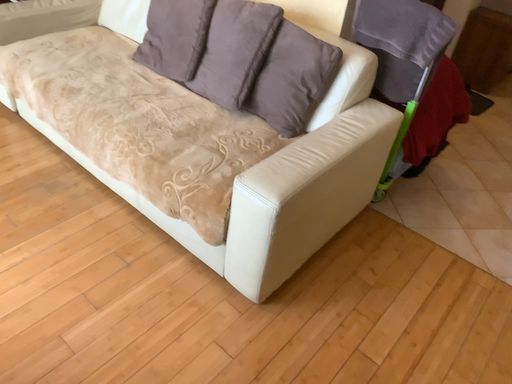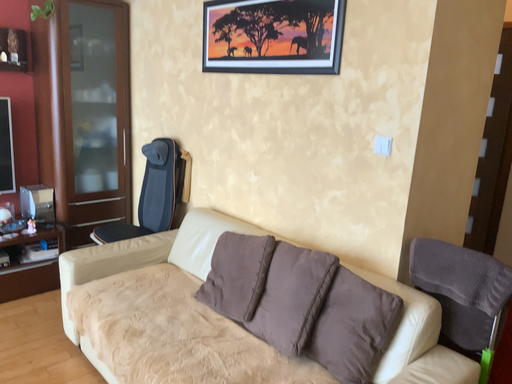
Question: Which way did the camera rotate in the video?

Choices:
 (A) rotated left
 (B) rotated right

Answer: (A)